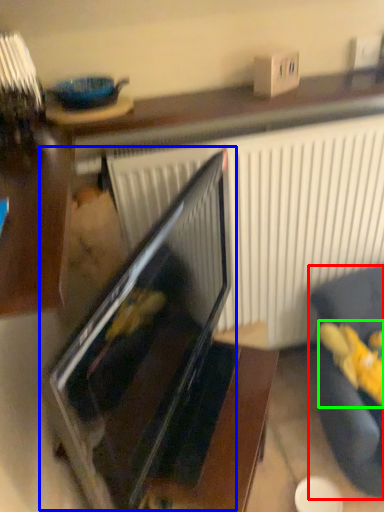
Question: Which is nearer to the furniture (highlighted by a red box)? oven (highlighted by a blue box) or stuff (highlighted by a green box).

Choices:
 (A) oven
 (B) stuff

Answer: (B)